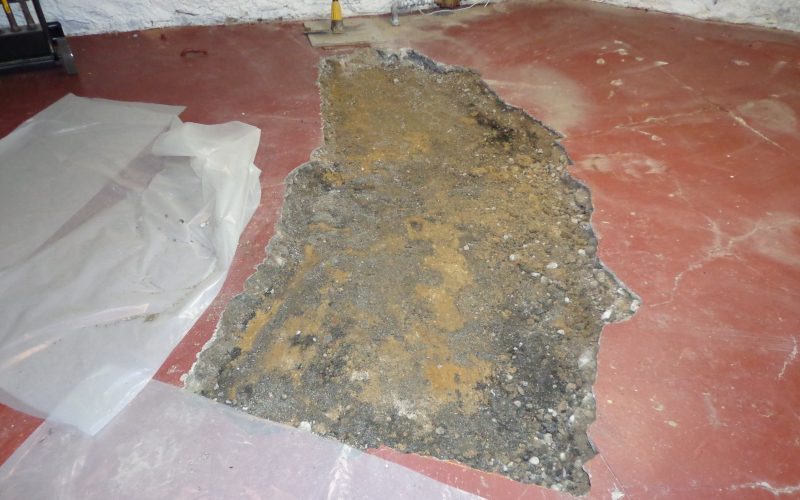
You are a GUI agent. You are given a task and a screenshot of the screen. Output one action in this format:
    pyautogui.click(x=<x>, y=<y>)
    Task: Click on the red laminate flooring
    
    Given the screenshot: What is the action you would take?
    pyautogui.click(x=652, y=386), pyautogui.click(x=594, y=92), pyautogui.click(x=229, y=90)